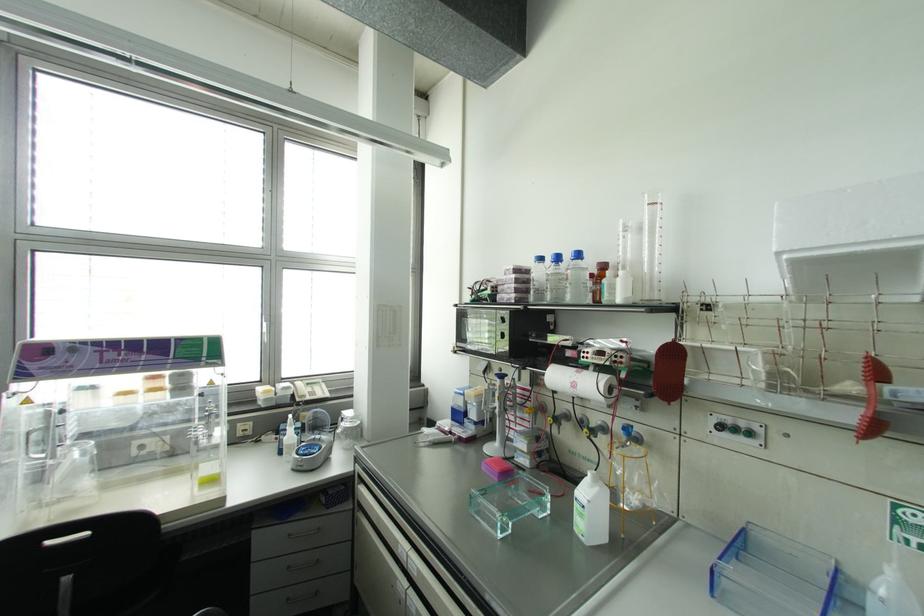
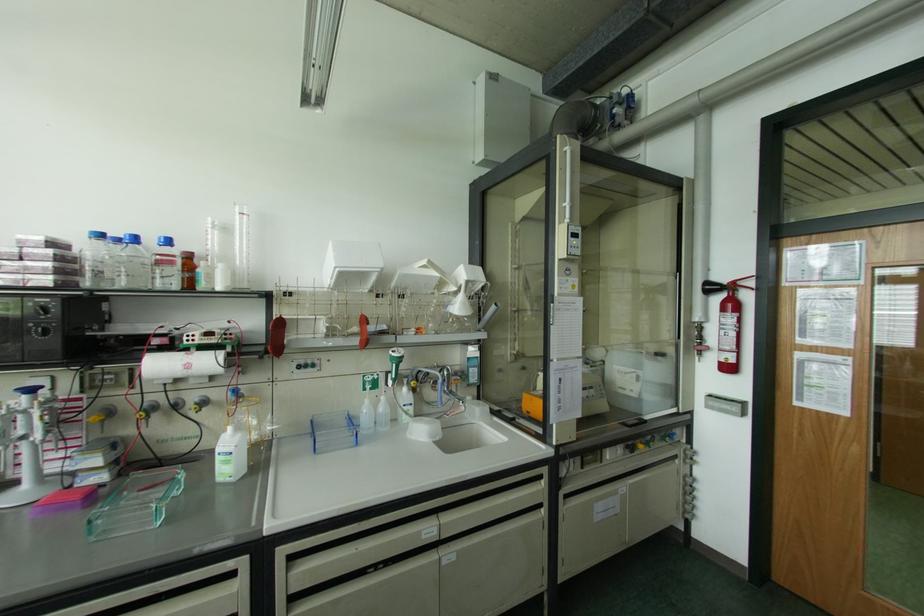
In the second image, find the point that corresponds to point 647,208 in the first image.

(237, 216)